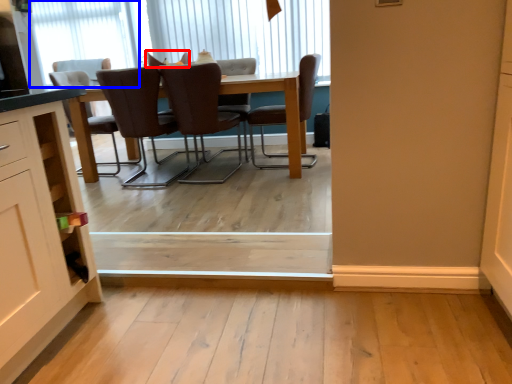
Question: Among these objects, which one is farthest to the camera, chair (highlighted by a red box) or window (highlighted by a blue box)?

Choices:
 (A) chair
 (B) window

Answer: (B)